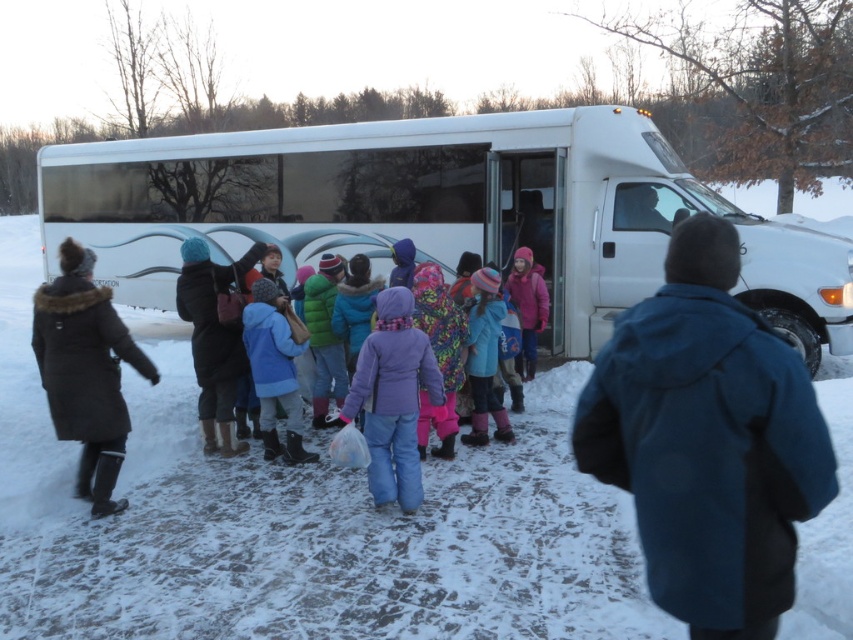
Question: Is dark brown fur-trimmed coat at left positioned in front of fluffy pink snow pants at center?

Choices:
 (A) yes
 (B) no

Answer: (A)

Question: Which point appears farthest from the camera in this image?

Choices:
 (A) (503, 410)
 (B) (105, 376)
 (C) (310, 204)
 (D) (396, 412)

Answer: (C)

Question: Does blue fabric jacket at lower right appear on the right side of multicolored knitted hat at center?

Choices:
 (A) no
 (B) yes

Answer: (B)

Question: Which point is farther to the camera?

Choices:
 (A) blue fabric jacket at lower right
 (B) dark brown fur-trimmed coat at left
 (C) fluffy pink snow pants at center
 (D) green fuzzy jacket at center

Answer: (D)

Question: Among these objects, which one is nearest to the camera?

Choices:
 (A) pink fleece jacket at center
 (B) fluffy pink snow pants at center
 (C) white glossy bus at center
 (D) black wool coat at center

Answer: (C)

Question: Is dark brown fur-trimmed coat at left closer to camera compared to blue fleece jacket at center?

Choices:
 (A) no
 (B) yes

Answer: (B)